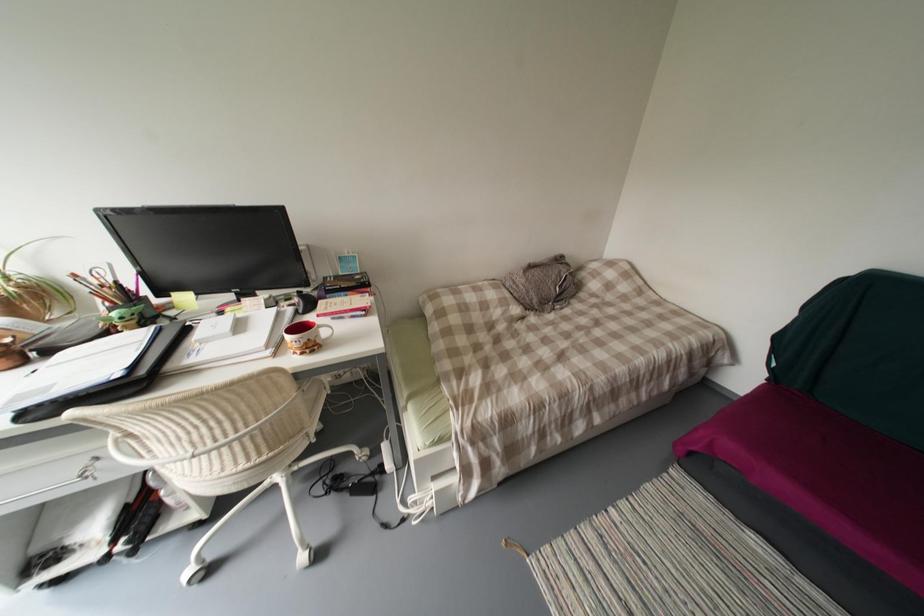
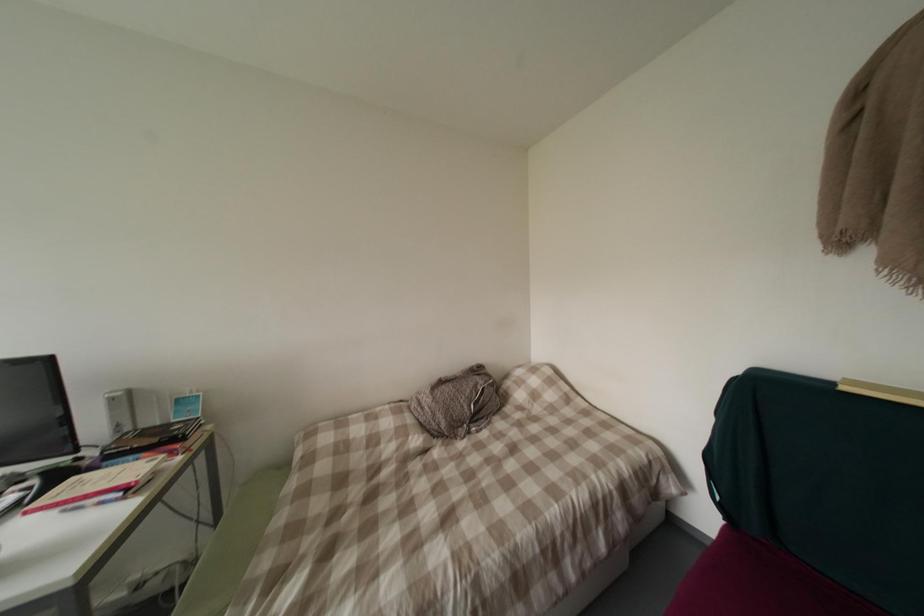
Question: Based on the continuous images, in which direction is the camera rotating? Reply with the corresponding letter.

Choices:
 (A) Left
 (B) Right
 (C) Up
 (D) Down

Answer: (C)